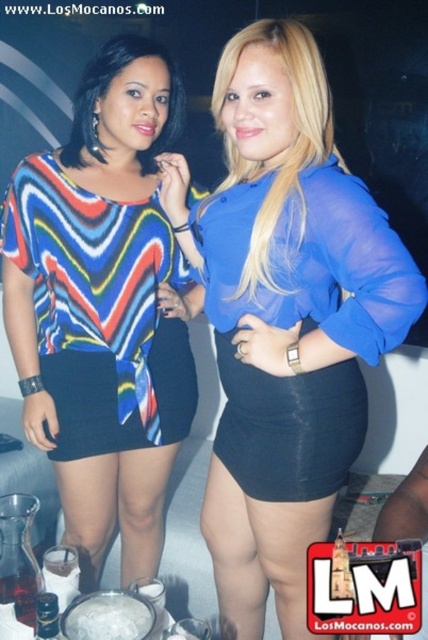
You are at a party and want to grab the shiny metallic bottle at lower left to get a drink. However, the multicolored fabric dress at center is blocking your path. Can you move around to the left side of the dress to reach the bottle?

The multicolored fabric dress at center is to the right of the shiny metallic bottle at lower left, so moving to the left side of the dress would allow you to access the bottle.

You are a photographer trying to capture a closeup of the blue sheer blouse at center. Based on its position in the image, what coordinates should you focus on to ensure the blouse is centered in your shot?

The blue sheer blouse at center is located at coordinates point (285,316), so focusing on those coordinates will center it in your shot.